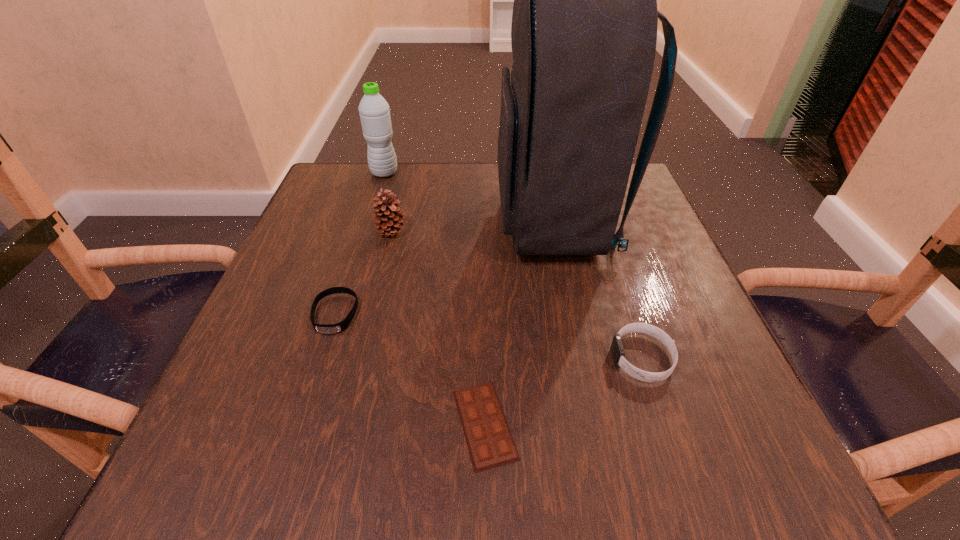
I want to click on free spot between the chocolate bar and the taller wristband, so click(x=564, y=391).

Locate an element on the screen. The height and width of the screenshot is (540, 960). vacant area that lies between the chocolate bar and the tallest object is located at coordinates (520, 323).

Locate which object is the fifth closest to the water bottle. Please provide its 2D coordinates. Your answer should be formatted as a tuple, i.e. [(x, y)], where the tuple contains the x and y coordinates of a point satisfying the conditions above.

[(617, 349)]

Locate which object is the fourth closest to the shortest object. Please provide its 2D coordinates. Your answer should be formatted as a tuple, i.e. [(x, y)], where the tuple contains the x and y coordinates of a point satisfying the conditions above.

[(389, 219)]

You are a GUI agent. You are given a task and a screenshot of the screen. Output one action in this format:
    pyautogui.click(x=<x>, y=<y>)
    Task: Click on the blank space that satisfies the following two spatial constraints: 1. on the front-facing side of the backpack; 2. on the display of the second shortest object
    This screenshot has width=960, height=540.
    Given the screenshot: What is the action you would take?
    pyautogui.click(x=575, y=314)

At what (x,y) coordinates should I click in order to perform the action: click on vacant space that satisfies the following two spatial constraints: 1. on the front side of the shortest object; 2. on the left side of the water bottle. Please return your answer as a coordinate pair (x, y). The image size is (960, 540). Looking at the image, I should click on coord(306,424).

At what (x,y) coordinates should I click in order to perform the action: click on free region that satisfies the following two spatial constraints: 1. on the front side of the second tallest object; 2. on the left side of the third tallest object. Please return your answer as a coordinate pair (x, y). Looking at the image, I should click on (367, 231).

I want to click on vacant space that satisfies the following two spatial constraints: 1. on the front-facing side of the tallest object; 2. on the front side of the pinecone, so click(x=558, y=231).